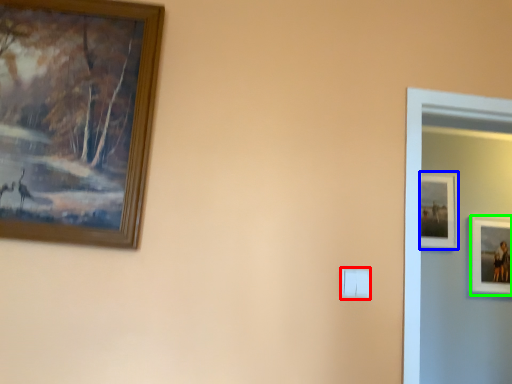
Question: Which object is positioned closest to light switch (highlighted by a red box)? Select from picture frame (highlighted by a blue box) and picture frame (highlighted by a green box).

Choices:
 (A) picture frame
 (B) picture frame

Answer: (A)